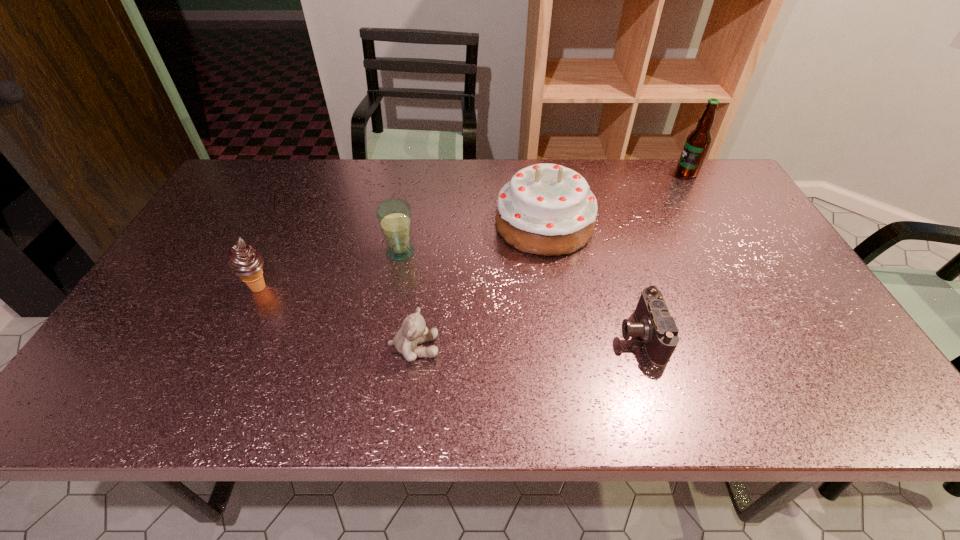
I want to click on object that is positioned at the right edge, so click(698, 141).

At what (x,y) coordinates should I click in order to perform the action: click on object present at the far right corner. Please return your answer as a coordinate pair (x, y). The image size is (960, 540). Looking at the image, I should click on (698, 141).

In the image, there is a desktop. What are the coordinates of `vacant region at the far edge` in the screenshot? It's located at (446, 159).

Where is `free space at the left edge`? free space at the left edge is located at coordinates (116, 375).

In the image, there is a desktop. At what (x,y) coordinates should I click in order to perform the action: click on free space at the right edge. Please return your answer as a coordinate pair (x, y). This screenshot has height=540, width=960. Looking at the image, I should click on (794, 330).

I want to click on vacant space at the far left corner of the desktop, so click(x=248, y=195).

The width and height of the screenshot is (960, 540). What are the coordinates of `vacant point at the near right corner` in the screenshot? It's located at (872, 401).

Identify the location of vacant area between the glass and the cake. The width and height of the screenshot is (960, 540). (472, 238).

Locate an element on the screen. This screenshot has height=540, width=960. free spot between the cake and the farthest object is located at coordinates (615, 199).

Locate an element on the screen. This screenshot has height=540, width=960. vacant space that's between the fifth tallest object and the camera is located at coordinates (527, 341).